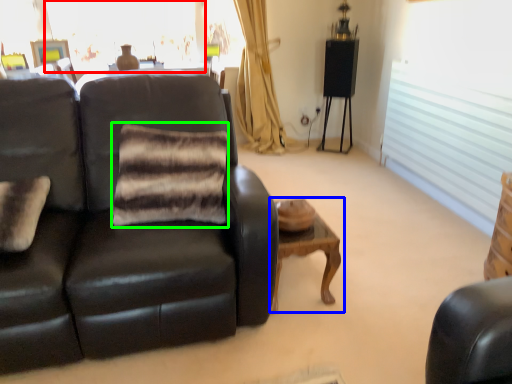
Question: Which is farther away from window (highlighted by a red box)? table (highlighted by a blue box) or pillow (highlighted by a green box)?

Choices:
 (A) table
 (B) pillow

Answer: (A)